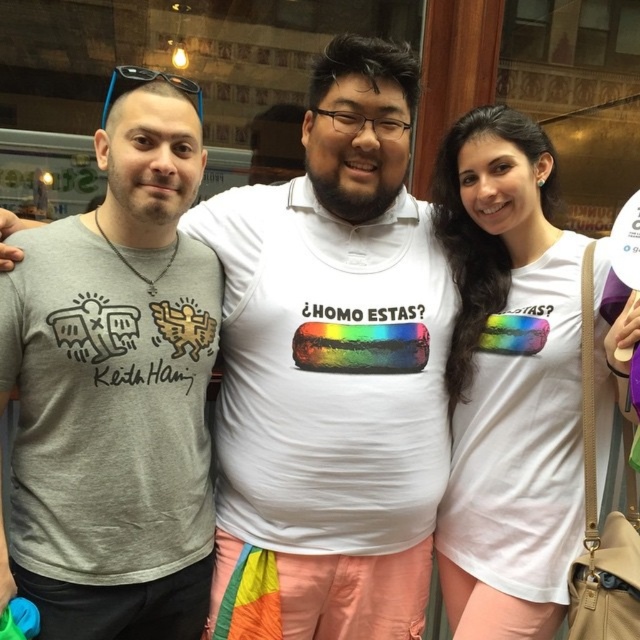
Question: Observing the image, what is the correct spatial positioning of gray cotton t-shirt at center in reference to white cotton t-shirt at center?

Choices:
 (A) right
 (B) left

Answer: (B)

Question: Which object is positioned farthest from the white cotton t-shirt at center?

Choices:
 (A) gray cotton t-shirt at center
 (B) gray matte t-shirt at left

Answer: (B)

Question: Does gray cotton t-shirt at center appear over gray matte t-shirt at left?

Choices:
 (A) yes
 (B) no

Answer: (A)

Question: Which of these objects is positioned farthest from the gray cotton t-shirt at center?

Choices:
 (A) gray matte t-shirt at left
 (B) white cotton t-shirt at center

Answer: (A)

Question: Is gray cotton t-shirt at center wider than gray matte t-shirt at left?

Choices:
 (A) yes
 (B) no

Answer: (A)

Question: Which object is closer to the camera taking this photo?

Choices:
 (A) white cotton t-shirt at center
 (B) gray matte t-shirt at left

Answer: (A)